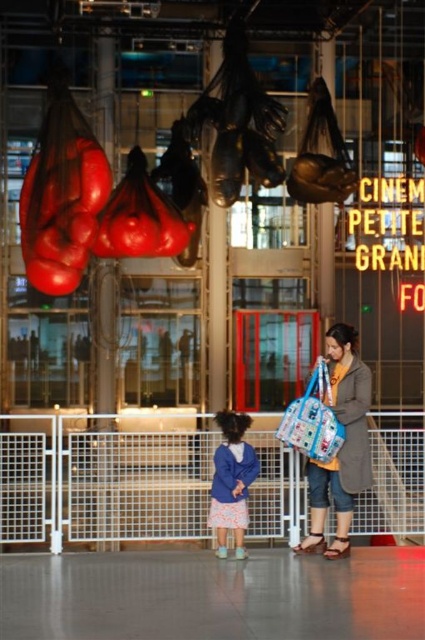
Which is more to the left, white metal fence at lower center or blue fabric bag at center?

white metal fence at lower center is more to the left.

Can you confirm if white metal fence at lower center is wider than blue fabric bag at center?

Correct, the width of white metal fence at lower center exceeds that of blue fabric bag at center.

Which is behind, point (380, 468) or point (331, 449)?

Point (380, 468)

Identify the location of white metal fence at lower center. (104, 477).

Is point (142, 433) positioned in front of point (365, 401)?

No, it is not.

Find the location of a particular element. The width and height of the screenshot is (425, 640). white metal fence at lower center is located at coordinates (104, 477).

Locate an element on the screen. Image resolution: width=425 pixels, height=640 pixels. white metal fence at lower center is located at coordinates tap(104, 477).

The image size is (425, 640). What do you see at coordinates (342, 445) in the screenshot?
I see `matte gray coat at center` at bounding box center [342, 445].

Is matte gray coat at center smaller than blue fabric bag at center?

Actually, matte gray coat at center might be larger than blue fabric bag at center.

Between point (351, 349) and point (328, 417), which one is positioned in front?

Positioned in front is point (328, 417).

Identify the location of matte gray coat at center. (342, 445).